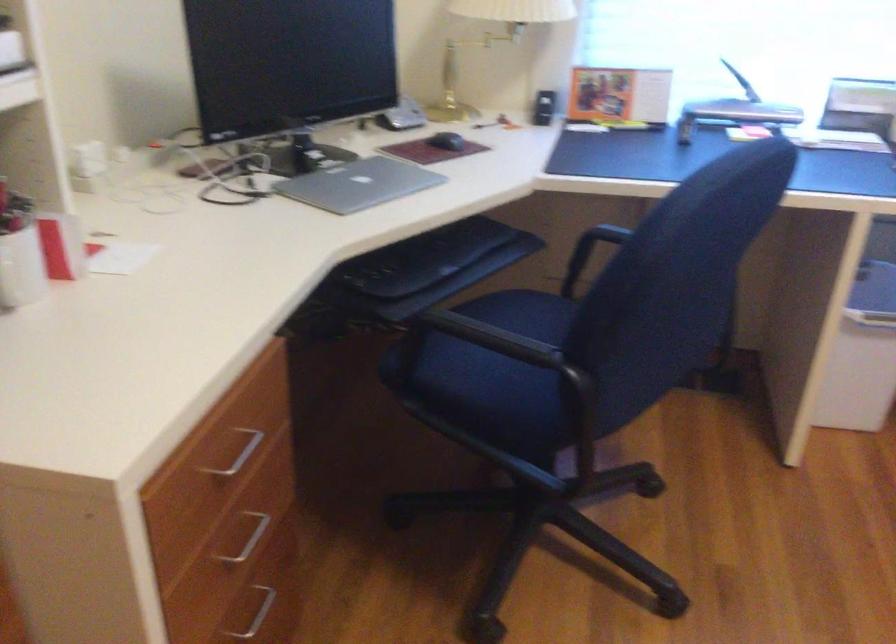
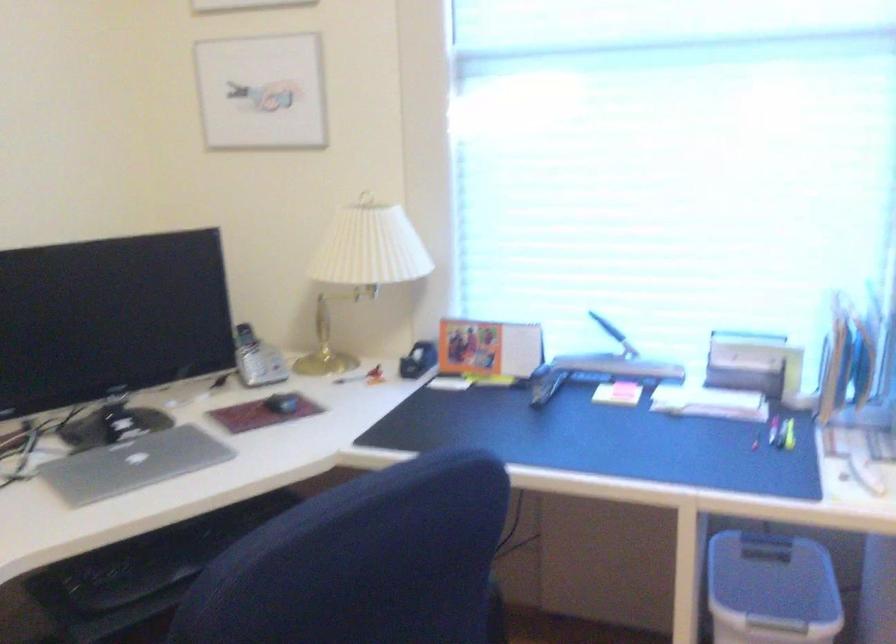
Where in the second image is the point corresponding to point (401, 102) from the first image?

(256, 359)